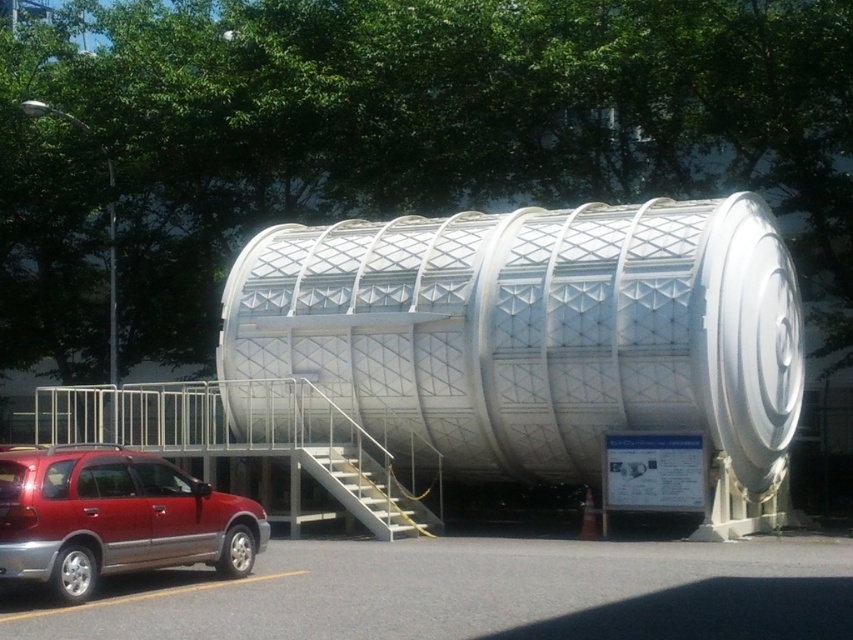
You are standing at the point labeled point (537,333). What object are you directly facing?

You are directly facing the white metallic tank at center.

You are a delivery driver who needs to park your truck, which is 25 feet long, between the white metallic tank at center and the shiny red suv at lower left. Is there enough space for your truck to fit without touching either object?

The distance between the white metallic tank at center and the shiny red suv at lower left is 27.70 feet. Since your truck is 25 feet long, there is enough space for it to fit between them without touching either object.

You are a delivery driver who needs to park your vehicle near the white metallic tank at center without blocking the shiny red suv at lower left. Based on the scene, which side of the tank should you park on to avoid blocking the SUV?

The white metallic tank at center is positioned on the right side of the shiny red suv at lower left. To avoid blocking the SUV, you should park on the left side of the white metallic tank at center since it is already to the right of the SUV.